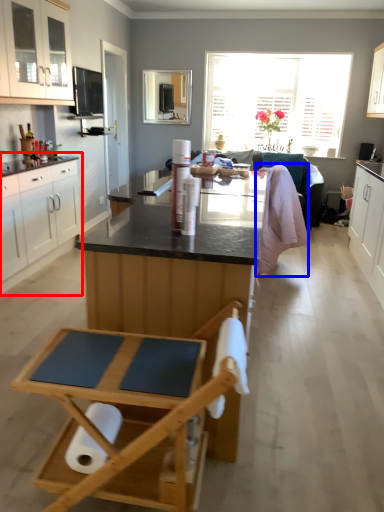
Question: Which object is closer to the camera taking this photo, cabinetry (highlighted by a red box) or blanket (highlighted by a blue box)?

Choices:
 (A) cabinetry
 (B) blanket

Answer: (A)